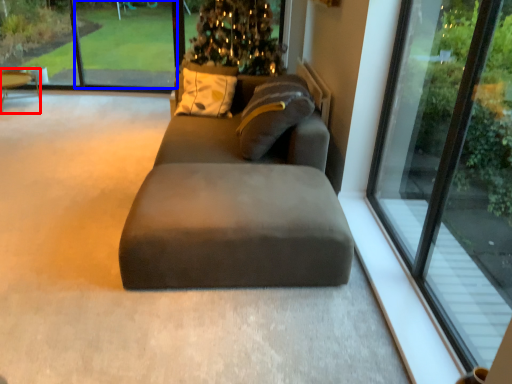
Question: Among these objects, which one is farthest to the camera, table (highlighted by a red box) or window screen (highlighted by a blue box)?

Choices:
 (A) table
 (B) window screen

Answer: (B)